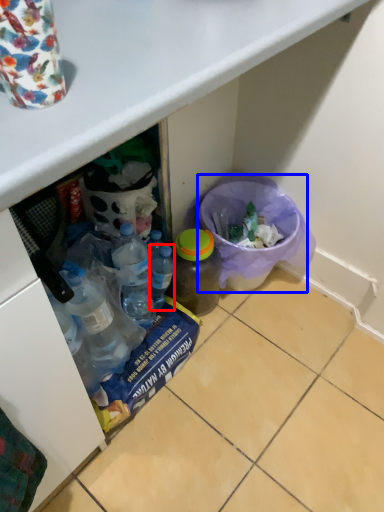
Question: Which object is closer to the camera taking this photo, bottle (highlighted by a red box) or recycling bin (highlighted by a blue box)?

Choices:
 (A) bottle
 (B) recycling bin

Answer: (A)